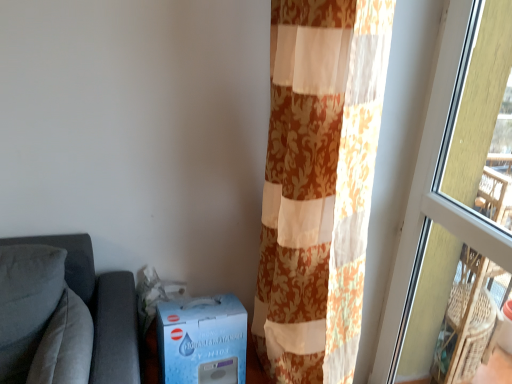
What do you see at coordinates (202, 340) in the screenshot?
I see `blue cardboard box at lower left` at bounding box center [202, 340].

The height and width of the screenshot is (384, 512). What do you see at coordinates (65, 345) in the screenshot?
I see `suede-like gray pillow at left` at bounding box center [65, 345].

Find the location of a particular element. floral fabric curtain at right is located at coordinates (319, 184).

Locate an element on the screen. blue cardboard box at lower left is located at coordinates (202, 340).

Would you say floral fabric curtain at right is outside blue cardboard box at lower left?

Yes.

Looking at this image, is floral fabric curtain at right to the left or to the right of blue cardboard box at lower left in the image?

Based on their positions, floral fabric curtain at right is located to the right of blue cardboard box at lower left.

From a real-world perspective, is floral fabric curtain at right positioned above or below blue cardboard box at lower left?

floral fabric curtain at right is situated higher than blue cardboard box at lower left in the real world.

From a real-world perspective, is suede-like gray pillow at left positioned over blue cardboard box at lower left based on gravity?

Incorrect, from a real-world perspective, suede-like gray pillow at left is lower than blue cardboard box at lower left.

Is suede-like gray pillow at left to the left of blue cardboard box at lower left from the viewer's perspective?

Yes, suede-like gray pillow at left is to the left of blue cardboard box at lower left.

Is suede-like gray pillow at left aimed at blue cardboard box at lower left?

Yes, suede-like gray pillow at left is turned towards blue cardboard box at lower left.

Measure the distance from suede-like gray pillow at left to blue cardboard box at lower left.

suede-like gray pillow at left is 11.51 inches from blue cardboard box at lower left.

Identify the location of pillow that is under the floral fabric curtain at right (from a real-world perspective). Image resolution: width=512 pixels, height=384 pixels. (65, 345).

Can we say suede-like gray pillow at left lies outside floral fabric curtain at right?

Yes, suede-like gray pillow at left is outside of floral fabric curtain at right.

How much distance is there between suede-like gray pillow at left and floral fabric curtain at right?

suede-like gray pillow at left is 27.34 inches from floral fabric curtain at right.

Can you confirm if blue cardboard box at lower left is thinner than floral fabric curtain at right?

Yes.

Considering the relative sizes of blue cardboard box at lower left and floral fabric curtain at right in the image provided, is blue cardboard box at lower left shorter than floral fabric curtain at right?

Indeed, blue cardboard box at lower left has a lesser height compared to floral fabric curtain at right.

How many degrees apart are the facing directions of blue cardboard box at lower left and floral fabric curtain at right?

89.1 degrees.

Between blue cardboard box at lower left and floral fabric curtain at right, which one has smaller size?

blue cardboard box at lower left is smaller.

From the picture: From the image's perspective, between suede-like gray pillow at left and transparent glass window at right, which one is located above?

transparent glass window at right is shown above in the image.

Could you tell me if suede-like gray pillow at left is turned towards transparent glass window at right?

Yes, suede-like gray pillow at left is oriented towards transparent glass window at right.

In terms of size, does suede-like gray pillow at left appear bigger or smaller than transparent glass window at right?

Considering their sizes, suede-like gray pillow at left takes up less space than transparent glass window at right.

Where is `window located on the right of suede-like gray pillow at left`? The height and width of the screenshot is (384, 512). window located on the right of suede-like gray pillow at left is located at coordinates (455, 209).

Considering the relative positions of transparent glass window at right and blue cardboard box at lower left in the image provided, is transparent glass window at right to the left or to the right of blue cardboard box at lower left?

transparent glass window at right is to the right of blue cardboard box at lower left.

In the image, is transparent glass window at right positioned in front of or behind blue cardboard box at lower left?

Clearly, transparent glass window at right is in front of blue cardboard box at lower left.

From a real-world perspective, which object stands above the other?

From a 3D spatial view, transparent glass window at right is above.

Is point (501, 100) positioned before point (188, 316)?

No, (501, 100) is behind (188, 316).

Can we say blue cardboard box at lower left lies outside transparent glass window at right?

blue cardboard box at lower left is positioned outside transparent glass window at right.

Between blue cardboard box at lower left and transparent glass window at right, which one appears on the right side from the viewer's perspective?

Positioned to the right is transparent glass window at right.

Measure the distance between blue cardboard box at lower left and transparent glass window at right.

A distance of 31.29 inches exists between blue cardboard box at lower left and transparent glass window at right.

Is blue cardboard box at lower left positioned far away from transparent glass window at right?

No, there isn't a large distance between blue cardboard box at lower left and transparent glass window at right.

You are a GUI agent. You are given a task and a screenshot of the screen. Output one action in this format:
    pyautogui.click(x=<x>, y=<y>)
    Task: Click on the cardboard box lying below the floral fabric curtain at right (from the image's perspective)
    This screenshot has width=512, height=384.
    Given the screenshot: What is the action you would take?
    pos(202,340)

This screenshot has width=512, height=384. What are the coordinates of `cardboard box above the suede-like gray pillow at left (from the image's perspective)` in the screenshot? It's located at (202, 340).

When comparing their distances from floral fabric curtain at right, does blue cardboard box at lower left or transparent glass window at right seem further?

Among the two, transparent glass window at right is located further to floral fabric curtain at right.

Which object lies further to the anchor point suede-like gray pillow at left, transparent glass window at right or floral fabric curtain at right?

transparent glass window at right is positioned further to the anchor suede-like gray pillow at left.

Based on their spatial positions, is transparent glass window at right or floral fabric curtain at right further from blue cardboard box at lower left?

Based on the image, transparent glass window at right appears to be further to blue cardboard box at lower left.

Estimate the real-world distances between objects in this image. Which object is further from transparent glass window at right, blue cardboard box at lower left or suede-like gray pillow at left?

suede-like gray pillow at left.

Looking at this image, looking at the image, which one is located closer to transparent glass window at right, suede-like gray pillow at left or floral fabric curtain at right?

The object closer to transparent glass window at right is floral fabric curtain at right.

From the image, which object appears to be nearer to transparent glass window at right, floral fabric curtain at right or suede-like gray pillow at left?

Based on the image, floral fabric curtain at right appears to be nearer to transparent glass window at right.

From the picture: Looking at the image, which one is located closer to floral fabric curtain at right, transparent glass window at right or suede-like gray pillow at left?

transparent glass window at right is closer to floral fabric curtain at right.

When comparing their distances from suede-like gray pillow at left, does blue cardboard box at lower left or transparent glass window at right seem closer?

blue cardboard box at lower left is positioned closer to the anchor suede-like gray pillow at left.

Locate an element on the screen. This screenshot has width=512, height=384. cardboard box between suede-like gray pillow at left and transparent glass window at right in the horizontal direction is located at coordinates (202, 340).

Where is `curtain located between blue cardboard box at lower left and transparent glass window at right in the left-right direction`? curtain located between blue cardboard box at lower left and transparent glass window at right in the left-right direction is located at coordinates (319, 184).

The image size is (512, 384). Find the location of `curtain between suede-like gray pillow at left and transparent glass window at right in the horizontal direction`. curtain between suede-like gray pillow at left and transparent glass window at right in the horizontal direction is located at coordinates coord(319,184).

I want to click on cardboard box between suede-like gray pillow at left and floral fabric curtain at right, so click(x=202, y=340).